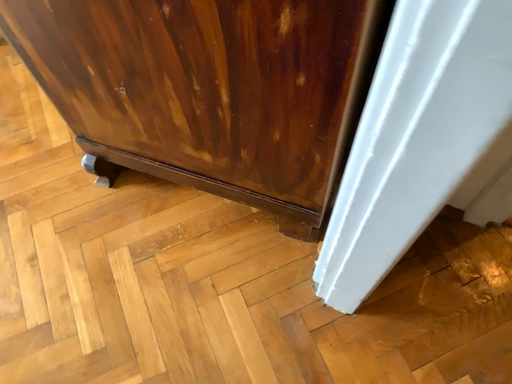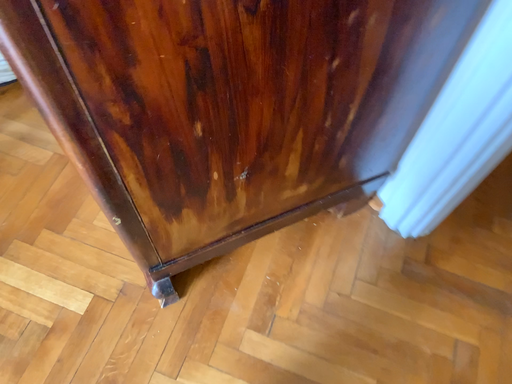
Question: Which way did the camera rotate in the video?

Choices:
 (A) rotated left
 (B) rotated right

Answer: (B)